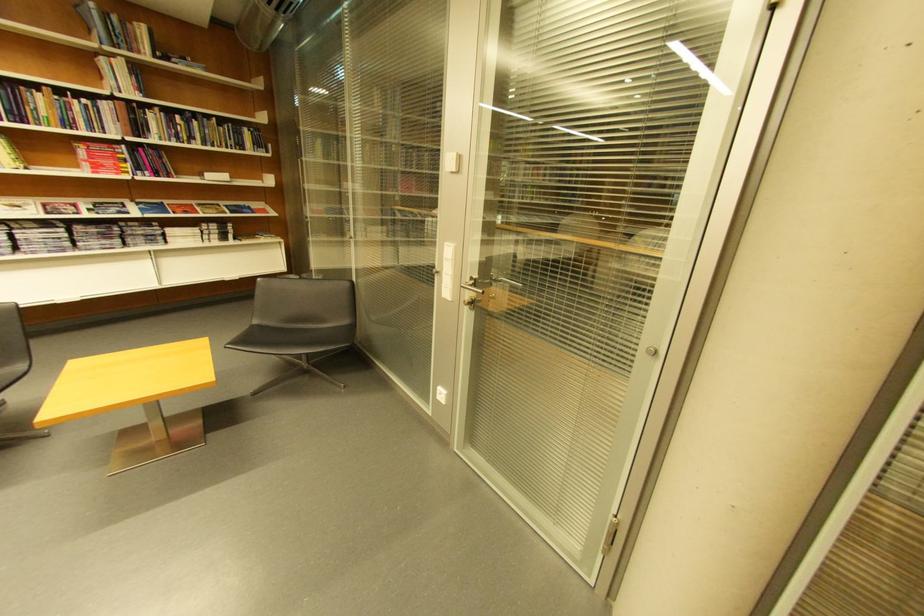
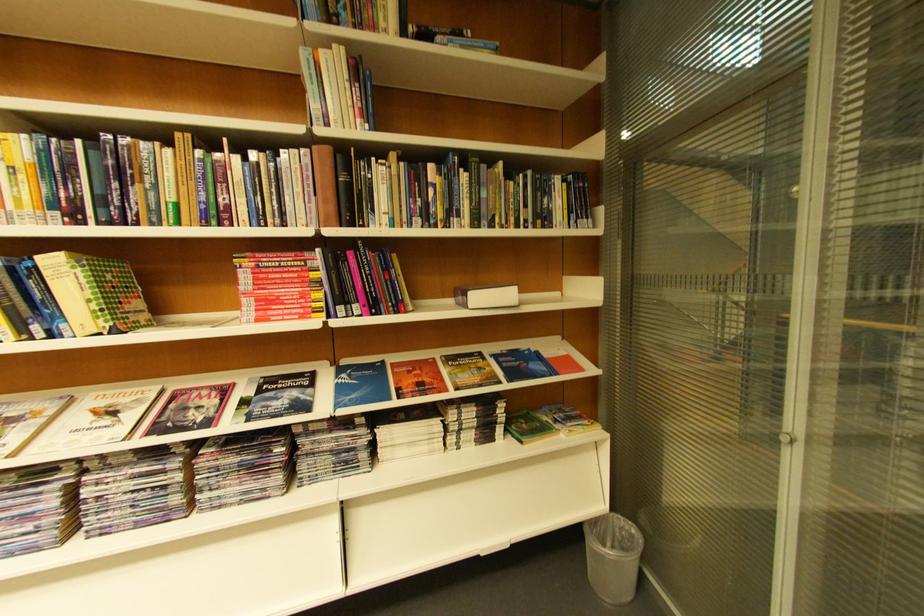
Find the pixel in the second image that matches (x=105, y=148) in the first image.

(281, 262)